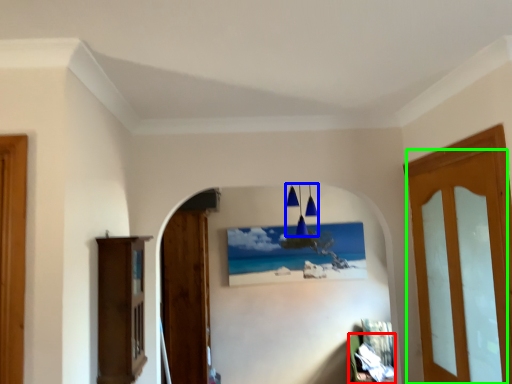
Question: Which object is the closest to the furniture (highlighted by a red box)? Choose among these: lamp (highlighted by a blue box) or door (highlighted by a green box).

Choices:
 (A) lamp
 (B) door

Answer: (A)